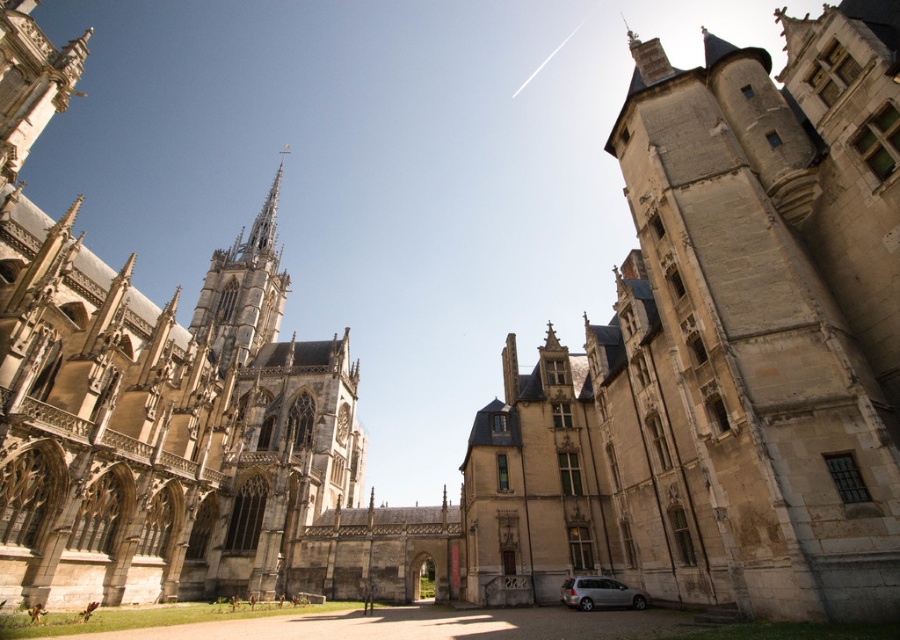
Question: Is stone castle at center to the left of stone gothic cathedral at left from the viewer's perspective?

Choices:
 (A) yes
 (B) no

Answer: (B)

Question: In this image, where is stone gothic cathedral at left located relative to stone spire at upper left?

Choices:
 (A) below
 (B) above

Answer: (B)

Question: Which object is the farthest from the stone castle at center?

Choices:
 (A) stone spire at upper left
 (B) silver metallic van at lower center

Answer: (A)

Question: Observing the image, what is the correct spatial positioning of stone spire at upper left in reference to silver metallic van at lower center?

Choices:
 (A) below
 (B) above

Answer: (B)

Question: Which of the following is the closest to the observer?

Choices:
 (A) silver metallic van at lower center
 (B) stone gothic cathedral at left
 (C) stone spire at upper left
 (D) stone castle at center

Answer: (D)

Question: Which is farther from the stone castle at center?

Choices:
 (A) stone spire at upper left
 (B) stone gothic cathedral at left
 (C) silver metallic van at lower center

Answer: (A)